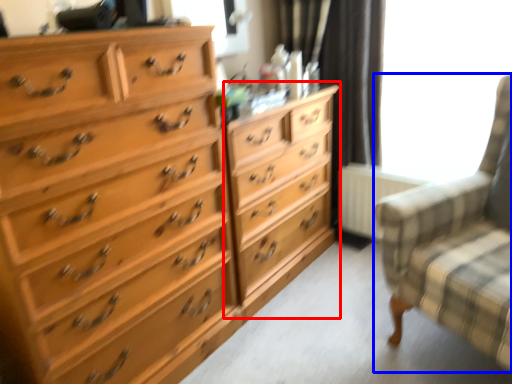
Question: Which object is further to the camera taking this photo, dresser (highlighted by a red box) or rocking chair (highlighted by a blue box)?

Choices:
 (A) dresser
 (B) rocking chair

Answer: (A)